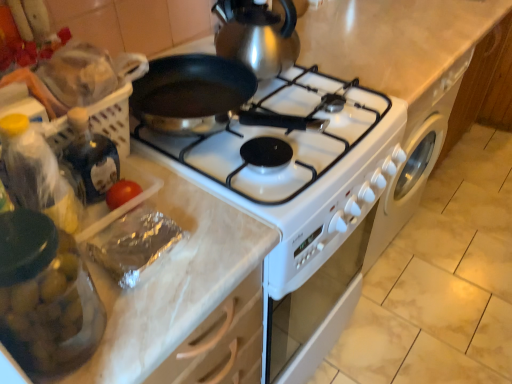
The image size is (512, 384). Identify the location of free space to the back side of silver foil meat at lower left. (172, 190).